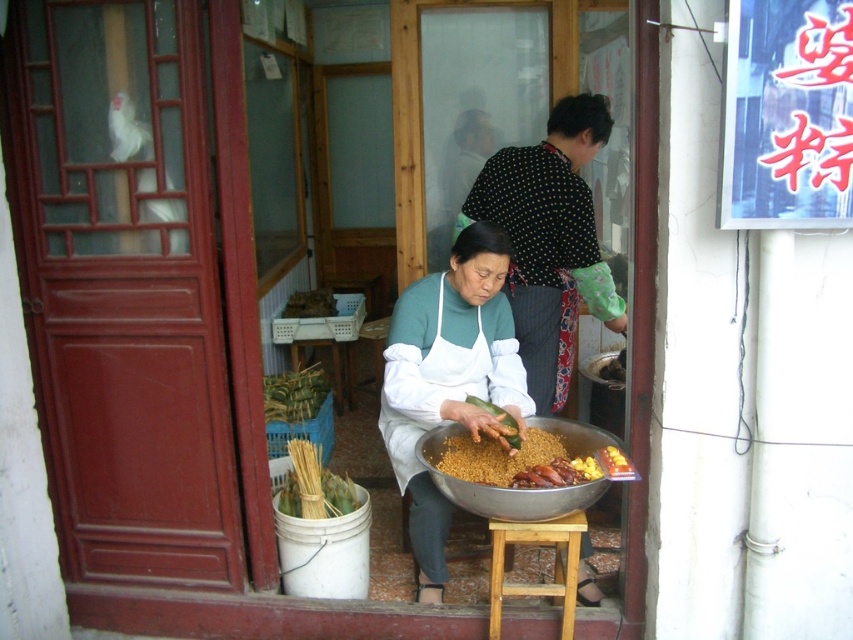
Between wooden stool at lower center and brown crispy food at center, which one is positioned higher?

brown crispy food at center is higher up.

Between point (561, 605) and point (601, 369), which one is positioned in front?

Point (561, 605) is in front.

Locate an element on the screen. Image resolution: width=853 pixels, height=640 pixels. wooden stool at lower center is located at coordinates (553, 564).

Can you confirm if brown matte bowl at center is positioned above brown matte roasted duck at center?

Yes.

Is brown matte bowl at center to the left of brown matte roasted duck at center from the viewer's perspective?

Indeed, brown matte bowl at center is positioned on the left side of brown matte roasted duck at center.

Which is in front, point (462, 454) or point (573, 476)?

Point (573, 476) is more forward.

The image size is (853, 640). Identify the location of brown matte bowl at center. (515, 461).

Which is above, brown matte roasted duck at center or green leafy vegetable at center?

Positioned higher is green leafy vegetable at center.

Between point (585, 458) and point (517, 442), which one is positioned in front?

Point (585, 458) is more forward.

The height and width of the screenshot is (640, 853). I want to click on brown matte roasted duck at center, so click(556, 474).